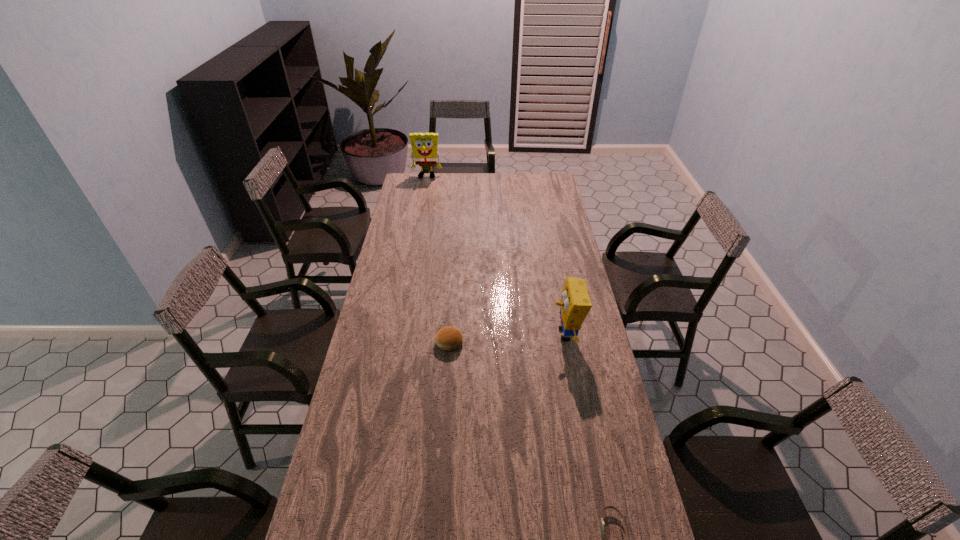
Find the location of `object at the far edge`. object at the far edge is located at coordinates (424, 145).

Where is `object located in the left edge section of the desktop`? object located in the left edge section of the desktop is located at coordinates (424, 145).

This screenshot has height=540, width=960. I want to click on object positioned at the right edge, so 575,304.

Identify the location of object positioned at the far left corner. Image resolution: width=960 pixels, height=540 pixels. (424, 145).

You are a GUI agent. You are given a task and a screenshot of the screen. Output one action in this format:
    pyautogui.click(x=<x>, y=<y>)
    Task: Click on the vacant area at the far edge of the desktop
    This screenshot has width=960, height=540.
    Given the screenshot: What is the action you would take?
    (452, 179)

Where is `vacant space at the left edge of the desktop`? This screenshot has width=960, height=540. vacant space at the left edge of the desktop is located at coordinates (402, 254).

You are a GUI agent. You are given a task and a screenshot of the screen. Output one action in this format:
    pyautogui.click(x=<x>, y=<y>)
    Task: Click on the free point at the right edge
    The image size is (960, 540).
    Given the screenshot: What is the action you would take?
    pyautogui.click(x=555, y=201)

This screenshot has height=540, width=960. I want to click on free point at the far left corner, so click(416, 175).

You are a GUI agent. You are given a task and a screenshot of the screen. Output one action in this format:
    pyautogui.click(x=<x>, y=<y>)
    Task: Click on the blank space at the far right corner of the desktop
    The width and height of the screenshot is (960, 540).
    Given the screenshot: What is the action you would take?
    pyautogui.click(x=535, y=178)

This screenshot has height=540, width=960. What are the coordinates of `vacant region between the farther sponge and the right sponge` in the screenshot? It's located at coord(496,255).